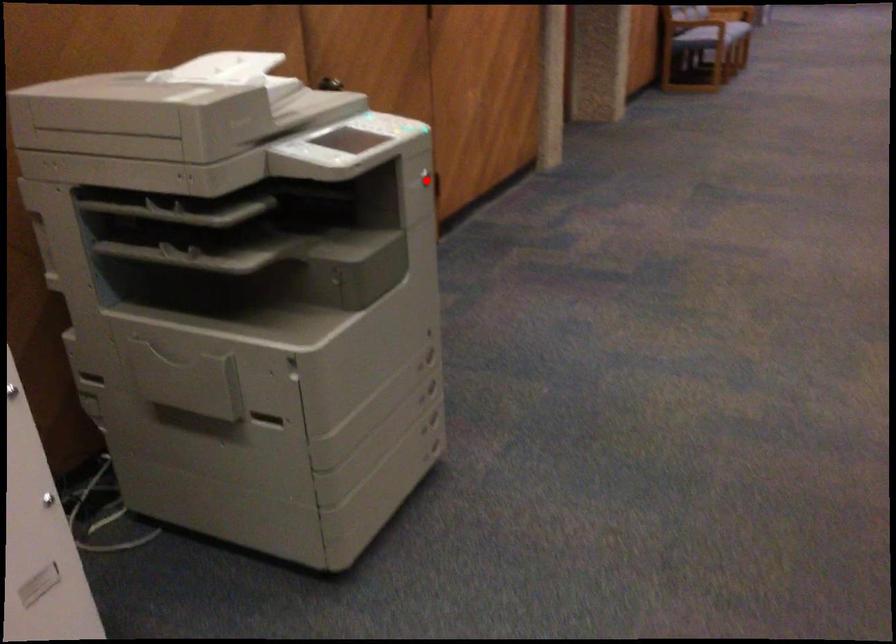
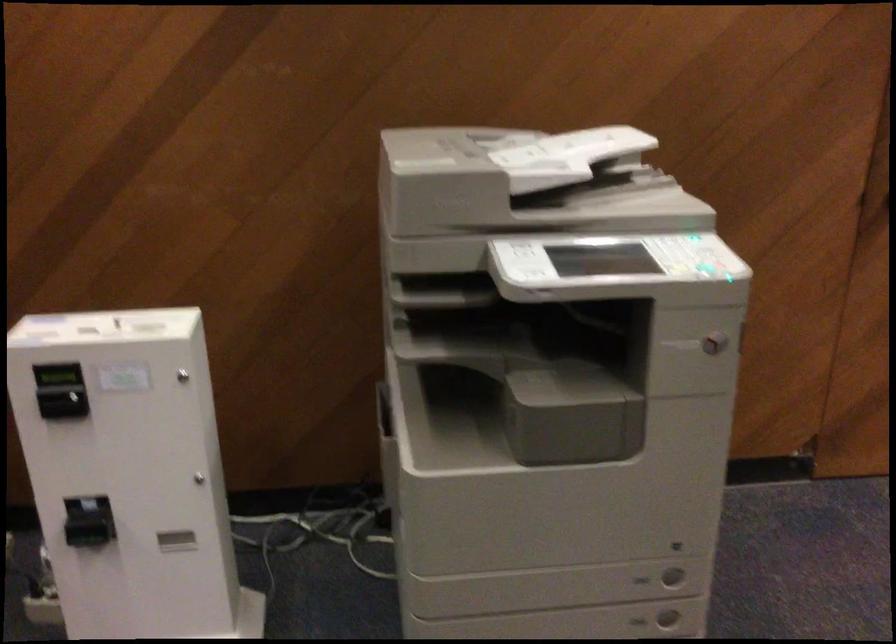
In the second image, find the point that corresponds to the highlighted location in the first image.

(713, 343)